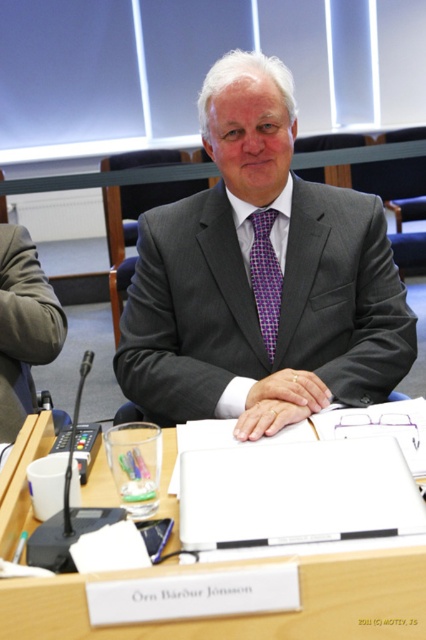
You are an attendee in the conference room and want to locate the central speaker. Where exactly is the gray textured suit at center positioned in the image?

The gray textured suit at center is positioned at the coordinates point (261, 278).

You are an interior designer assessing the conference room setup. The wooden table at center and the purple checkered tie at center are both in view. Which object is positioned lower in the image?

The wooden table at center is positioned lower in the image since it has a lesser height compared to the purple checkered tie at center.